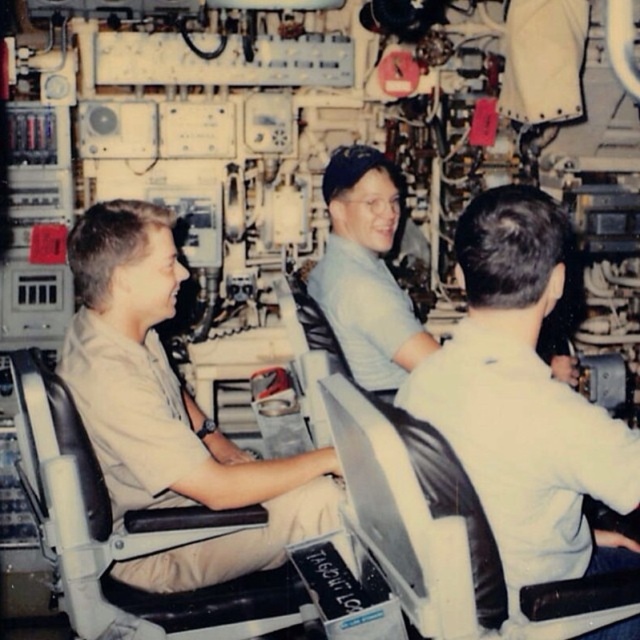
Question: Can you confirm if white matte shirt at center is thinner than black leather chair at center?

Choices:
 (A) yes
 (B) no

Answer: (A)

Question: Which object is positioned closest to the light blue shirt at center?

Choices:
 (A) black leather chair at left
 (B) white matte shirt at center
 (C) light brown uniform at left

Answer: (C)

Question: Is black leather chair at center wider than light blue shirt at center?

Choices:
 (A) yes
 (B) no

Answer: (A)

Question: Estimate the real-world distances between objects in this image. Which object is closer to the black leather chair at left?

Choices:
 (A) light blue shirt at center
 (B) black leather chair at center

Answer: (B)

Question: Which point appears farthest from the camera in this image?

Choices:
 (A) [492, 240]
 (B) [77, 396]
 (C) [132, 515]

Answer: (B)

Question: Is black leather chair at left below black leather chair at center?

Choices:
 (A) yes
 (B) no

Answer: (A)